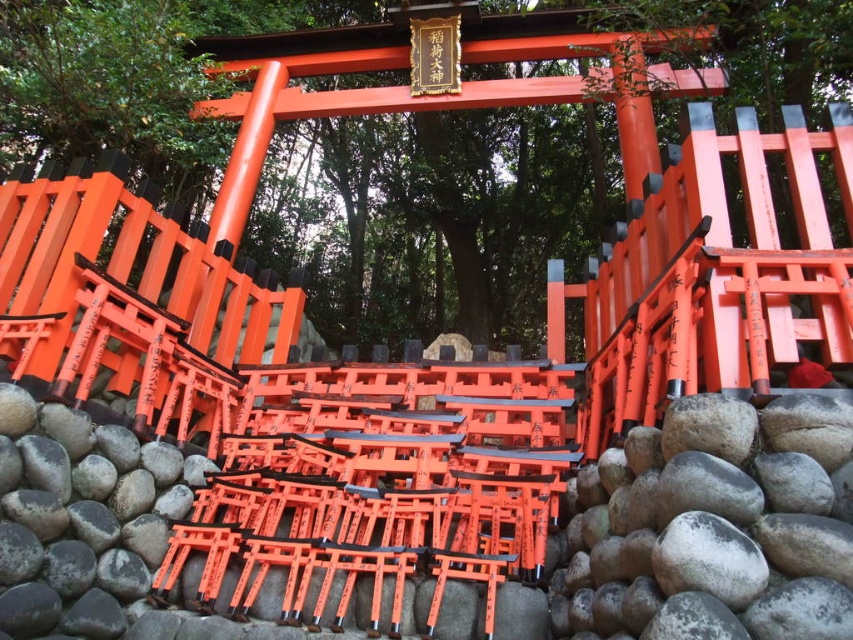
Question: Is gray/rough rock at lower center to the right of smooth gray rock at center from the viewer's perspective?

Choices:
 (A) yes
 (B) no

Answer: (A)

Question: Which point is closer to the camera?

Choices:
 (A) gray/rough rock at lower center
 (B) smooth gray rock at center

Answer: (A)

Question: Among these points, which one is farthest from the camera?

Choices:
 (A) (666, 426)
 (B) (73, 557)

Answer: (B)

Question: Does gray/rough rock at lower center appear on the right side of smooth gray rock at center?

Choices:
 (A) no
 (B) yes

Answer: (B)

Question: Which point is farther from the camera taking this photo?

Choices:
 (A) (766, 499)
 (B) (1, 435)

Answer: (B)

Question: Is gray/rough rock at lower center smaller than smooth gray rock at center?

Choices:
 (A) no
 (B) yes

Answer: (A)